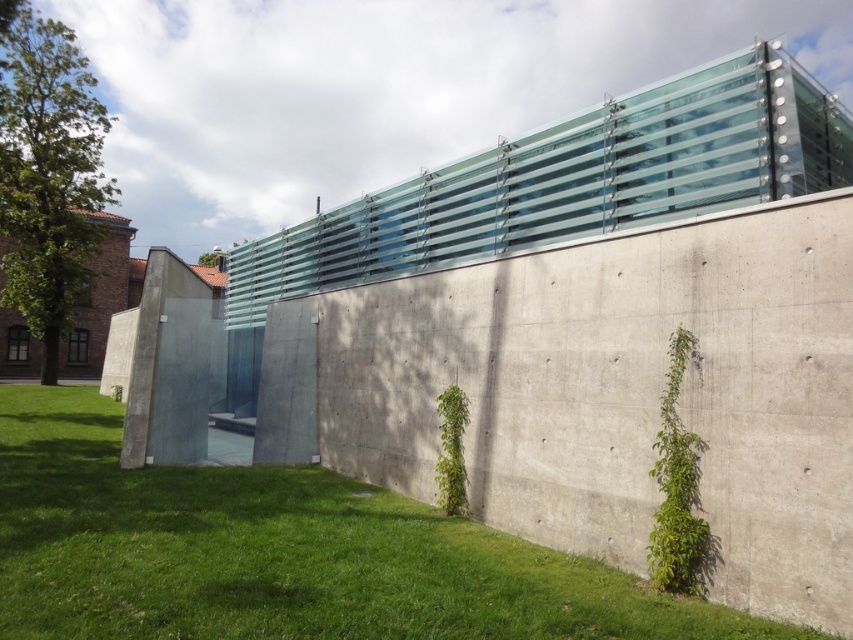
Question: Which point is farther from the camera taking this photo?

Choices:
 (A) (457, 456)
 (B) (675, 589)

Answer: (A)

Question: Can you confirm if green leafy ivy at lower right is positioned above green leafy ivy at center?

Choices:
 (A) yes
 (B) no

Answer: (A)

Question: Considering the real-world distances, which object is farthest from the green leafy ivy at center?

Choices:
 (A) green grass at lower left
 (B) green leafy ivy at lower right

Answer: (B)

Question: Is green leafy ivy at lower right above green leafy ivy at center?

Choices:
 (A) yes
 (B) no

Answer: (A)

Question: Is the position of green grass at lower left more distant than that of green leafy ivy at center?

Choices:
 (A) yes
 (B) no

Answer: (B)

Question: Estimate the real-world distances between objects in this image. Which object is closer to the green grass at lower left?

Choices:
 (A) green leafy ivy at lower right
 (B) green leafy ivy at center

Answer: (B)